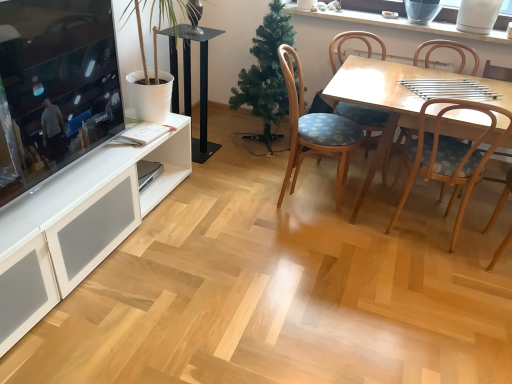
I want to click on free space in front of light wood table at center, so click(391, 301).